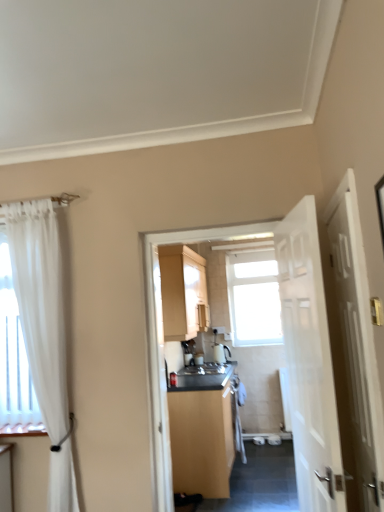
Question: Relative to matte wood cabinet at center, which is counted as the second cabinetry, starting from the top, is matte wood cabinet at center, the first cabinetry when ordered from top to bottom, in front or behind?

Choices:
 (A) front
 (B) behind

Answer: (B)

Question: From a real-world perspective, relative to matte wood cabinet at center, which is the first cabinetry in bottom-to-top order, is matte wood cabinet at center, the first cabinetry when ordered from top to bottom, vertically above or below?

Choices:
 (A) below
 (B) above

Answer: (B)

Question: Based on their relative distances, which object is nearer to the white wooden door at right, acting as the second door starting from the right?

Choices:
 (A) matte wood cabinet at center, the second cabinetry from the bottom
 (B) white glossy door at right, the 2th door from the left
 (C) transparent glass window at center
 (D) white sheer curtain at left
 (E) white glossy sink at center

Answer: (B)

Question: Considering the real-world distances, which object is closest to the matte wood cabinet at center, which is counted as the second cabinetry, starting from the top?

Choices:
 (A) white glossy door at right, arranged as the first door when viewed from the right
 (B) matte wood cabinet at center, the first cabinetry when ordered from top to bottom
 (C) white sheer curtain at left
 (D) transparent glass window at center
 (E) white glossy sink at center

Answer: (E)